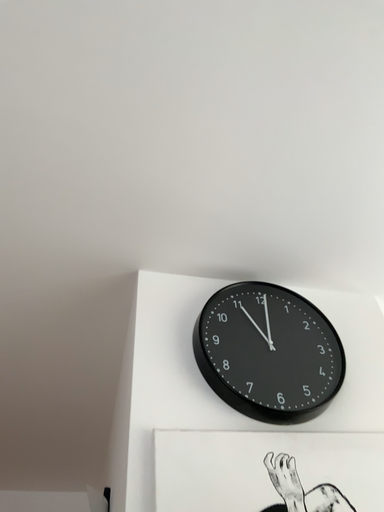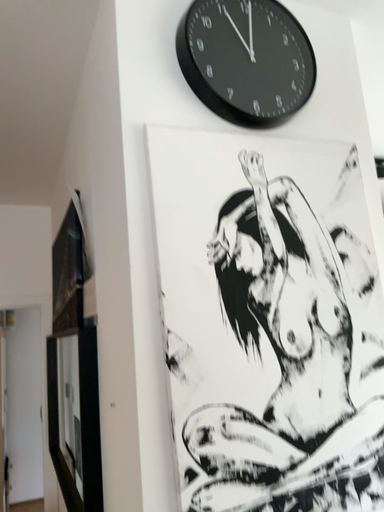
Question: How did the camera likely rotate when shooting the video?

Choices:
 (A) rotated right
 (B) rotated left

Answer: (A)